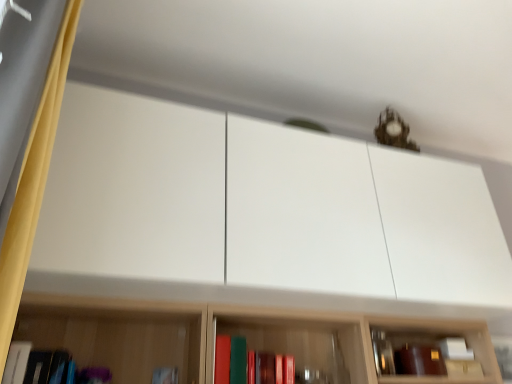
Question: Visually, is matte red book at center, which is the third book from left to right, positioned to the left or to the right of yellow fabric curtain at left?

Choices:
 (A) right
 (B) left

Answer: (A)

Question: From their relative heights in the image, would you say matte red book at center, the first book when ordered from right to left, is taller or shorter than yellow fabric curtain at left?

Choices:
 (A) short
 (B) tall

Answer: (A)

Question: Estimate the real-world distances between objects in this image. Which object is farther from the matte white book at lower left, marked as the second book in a right-to-left arrangement?

Choices:
 (A) matte black book at lower left, placed as the third book when sorted from right to left
 (B) matte red book at center, which is the third book from left to right
 (C) yellow fabric curtain at left

Answer: (C)

Question: Which object is the closest to the matte white book at lower left, marked as the second book in a right-to-left arrangement?

Choices:
 (A) yellow fabric curtain at left
 (B) matte red book at center, which is the third book from left to right
 (C) matte black book at lower left, placed as the third book when sorted from right to left

Answer: (B)